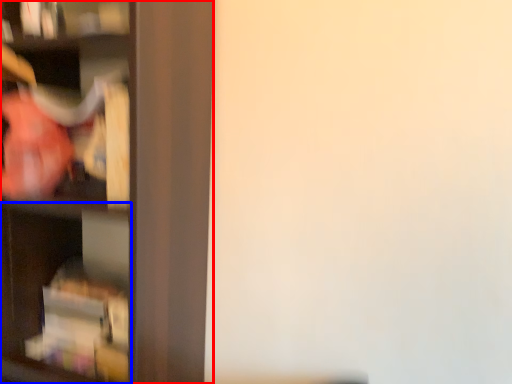
Question: Which point is further to the camera, shelf (highlighted by a red box) or cabinet (highlighted by a blue box)?

Choices:
 (A) shelf
 (B) cabinet

Answer: (B)